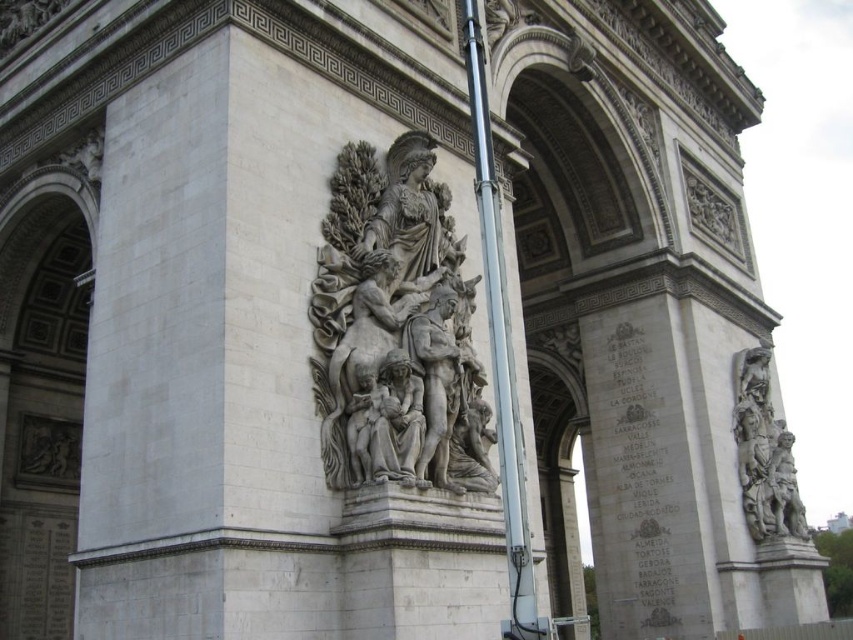
You are standing in front of the Arc de Triomphe and want to take a photo of the white marble sculpture at center. If your camera has a maximum focus range of 35 meters, will you be able to focus on the sculpture?

The white marble sculpture at center is 39.01 meters away from the viewer, which exceeds the camera maximum focus range of 35 meters. Therefore, the camera cannot focus on the sculpture.

You are a tour guide explaining the Arc de Triomphe to visitors. You point out the metallic silver pole at center and the gray stone sculpture at right. Which object is narrower?

The metallic silver pole at center is narrower than the gray stone sculpture at right.

What are the coordinates of the white marble sculpture at center in the image?

The white marble sculpture at center is located at coordinates point (396, 330).